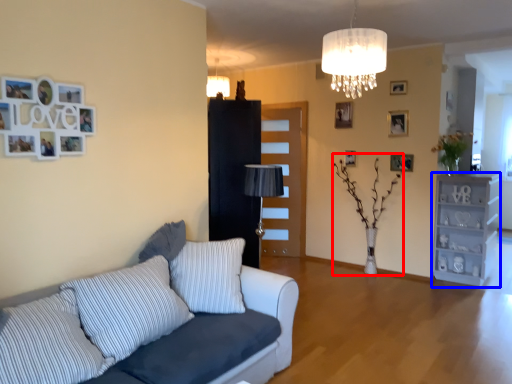
Question: Which of the following is the closest to the observer, plant (highlighted by a red box) or shelf (highlighted by a blue box)?

Choices:
 (A) plant
 (B) shelf

Answer: (A)